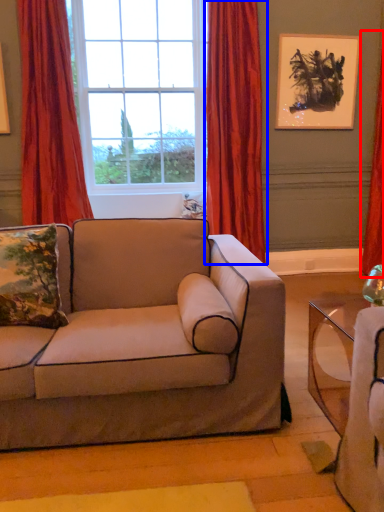
Question: Which point is closer to the camera, curtain (highlighted by a red box) or curtain (highlighted by a blue box)?

Choices:
 (A) curtain
 (B) curtain

Answer: (B)